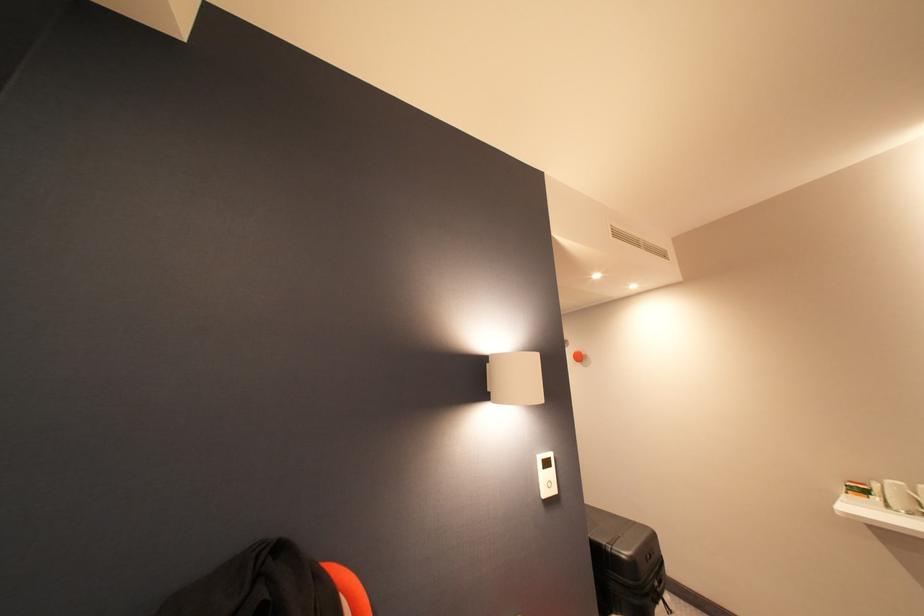
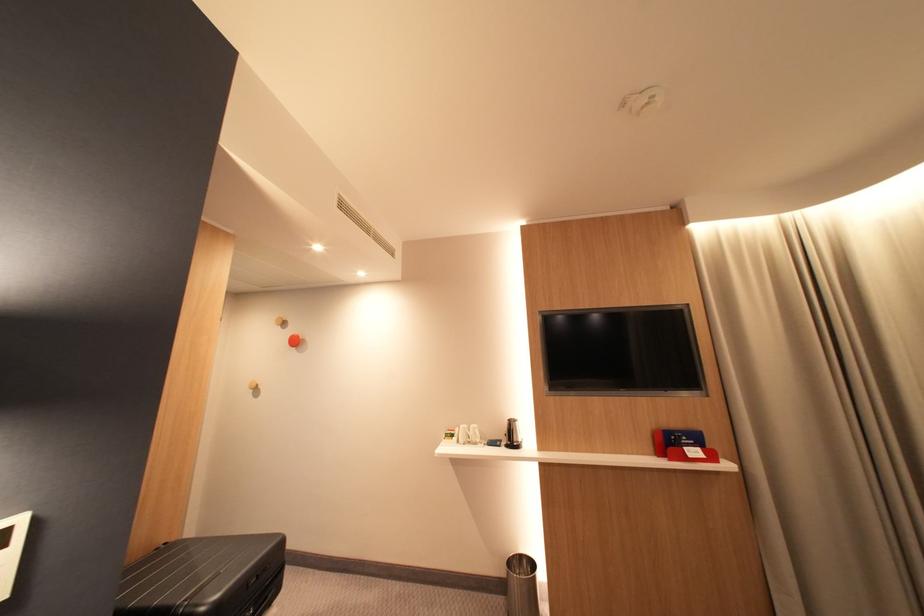
Find the pixel in the second image that matches point (876, 493) in the first image.

(463, 437)